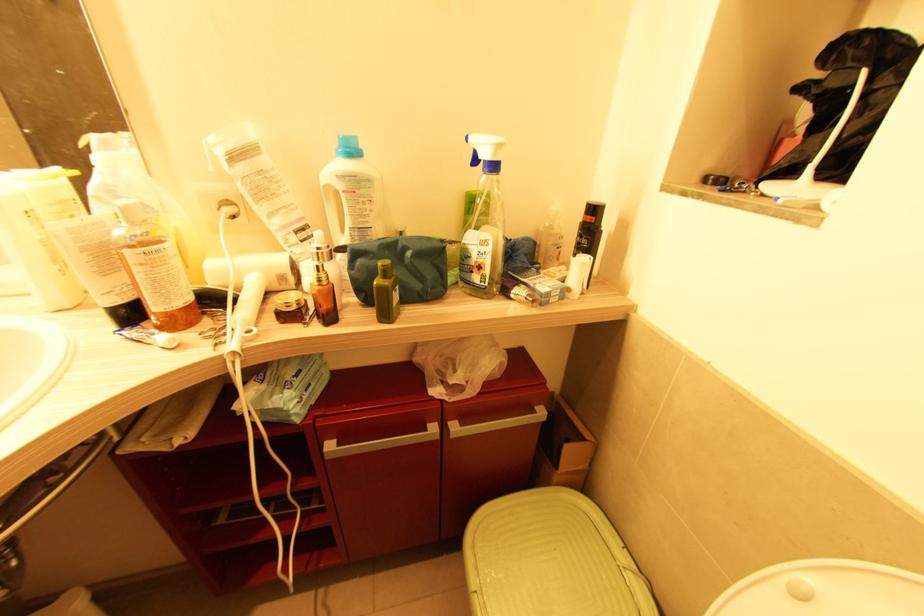
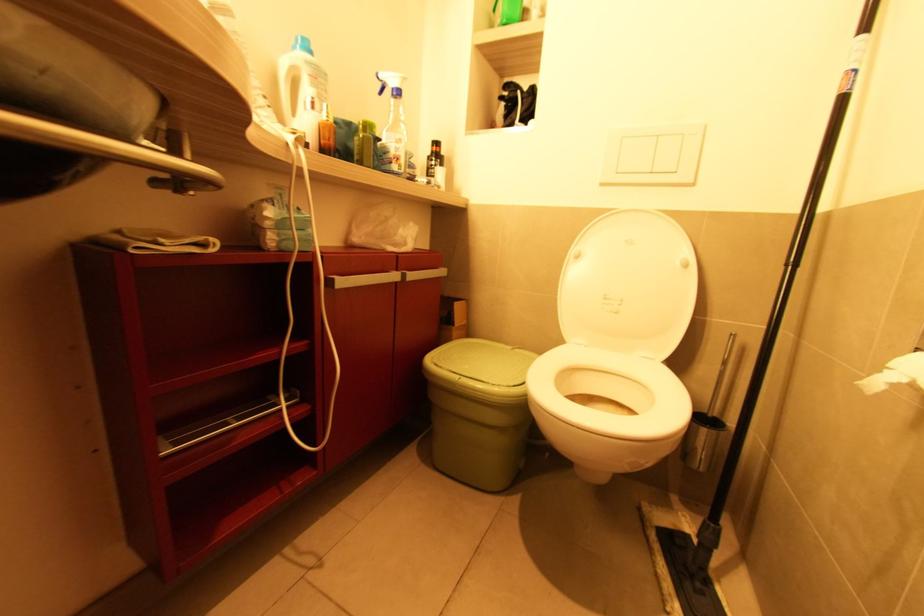
Question: The images are taken continuously from a first-person perspective. In which direction is your viewpoint rotating?

Choices:
 (A) Left
 (B) Right
 (C) Up
 (D) Down

Answer: (B)